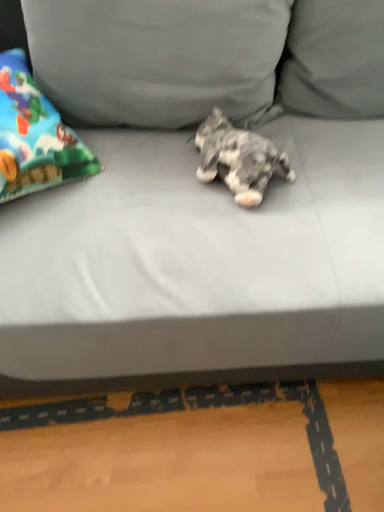
Image resolution: width=384 pixels, height=512 pixels. Find the location of `vacant area that is situated to the right of fluffy gray dog at center`. vacant area that is situated to the right of fluffy gray dog at center is located at coordinates (320, 166).